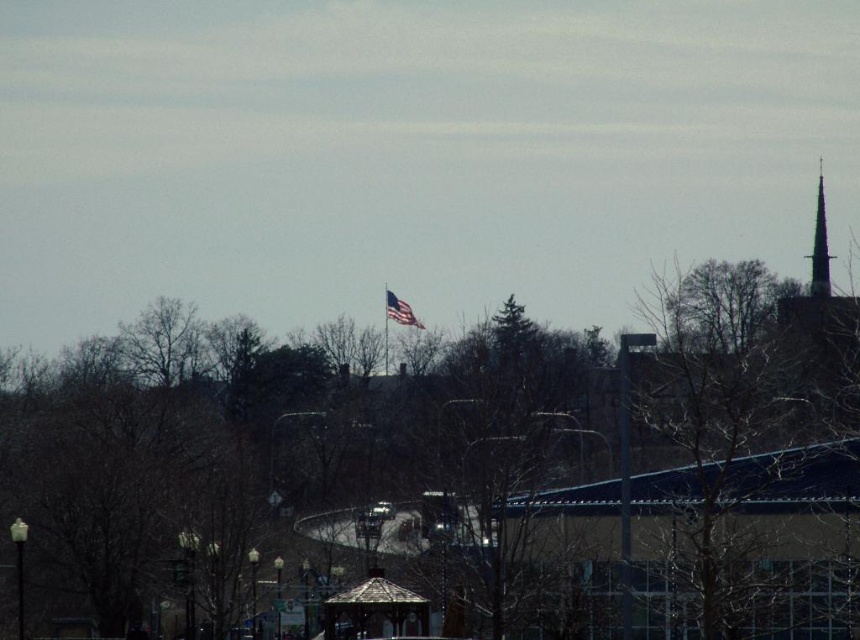
Question: Is bare branches at right bigger than smooth gray spire at upper right?

Choices:
 (A) no
 (B) yes

Answer: (B)

Question: Is bare branches at right bigger than metallic flag pole at center?

Choices:
 (A) yes
 (B) no

Answer: (A)

Question: Which point appears farthest from the camera in this image?

Choices:
 (A) (387, 308)
 (B) (385, 284)
 (C) (668, 284)

Answer: (B)

Question: Is wooden gazebo at center closer to the viewer compared to metallic flag pole at center?

Choices:
 (A) no
 (B) yes

Answer: (B)

Question: Which of the following is the closest to the observer?

Choices:
 (A) (759, 337)
 (B) (395, 301)
 (C) (355, 632)
 (D) (385, 305)

Answer: (C)

Question: Which point appears closest to the camera in this image?

Choices:
 (A) (710, 433)
 (B) (392, 304)
 (C) (821, 232)

Answer: (A)